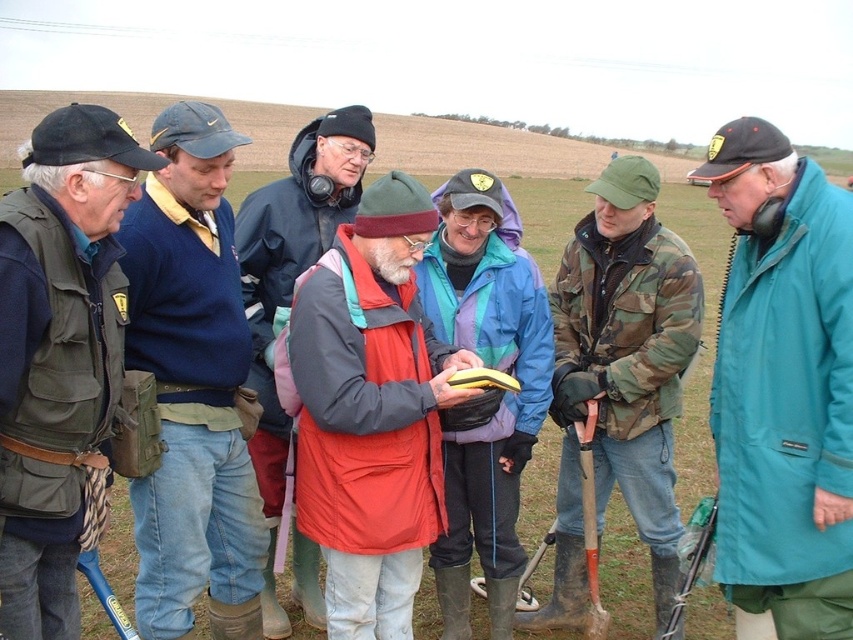
Question: Which of the following is the farthest from the observer?

Choices:
 (A) matte green vest at left
 (B) blue sweater at left

Answer: (B)

Question: Does teal waterproof jacket at center appear on the right side of matte green vest at left?

Choices:
 (A) no
 (B) yes

Answer: (B)

Question: Among these points, which one is nearest to the camera?

Choices:
 (A) (598, 424)
 (B) (482, 488)
 (C) (196, 177)

Answer: (C)

Question: Which of the following is the farthest from the observer?

Choices:
 (A) matte green vest at left
 (B) blue waterproof jacket at center
 (C) red jacket at center
 (D) camouflage jacket at center

Answer: (B)

Question: Can you confirm if matte green vest at left is positioned below blue waterproof jacket at center?

Choices:
 (A) no
 (B) yes

Answer: (A)

Question: Is blue sweater at left bigger than red matte jacket at center?

Choices:
 (A) yes
 (B) no

Answer: (B)